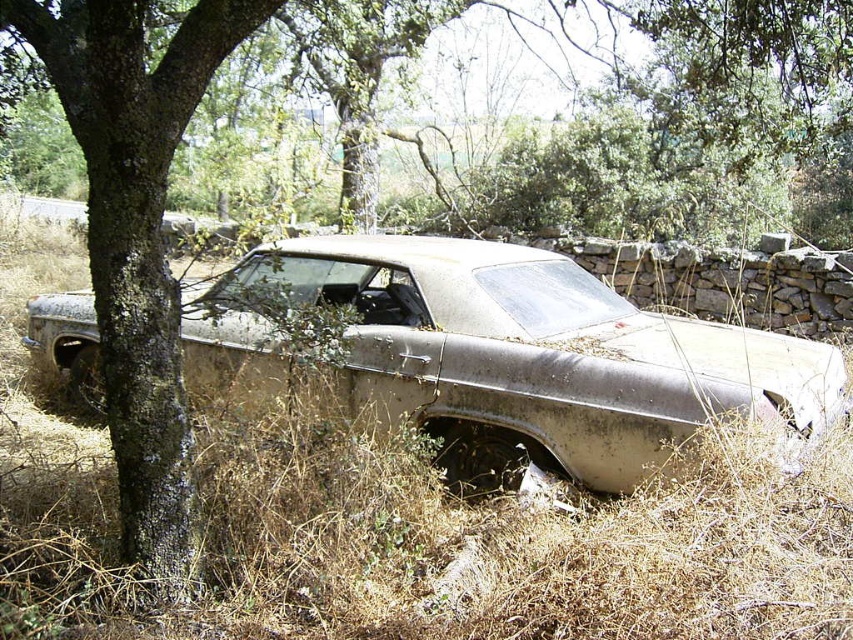
Between rusty metallic car at center and green rough bark tree at left, which one has less height?

rusty metallic car at center is shorter.

Does point (810, 342) come behind point (178, 477)?

Yes, point (810, 342) is behind point (178, 477).

Between point (828, 356) and point (276, 4), which one is positioned behind?

Positioned behind is point (828, 356).

Where is `rusty metallic car at center`? rusty metallic car at center is located at coordinates (509, 353).